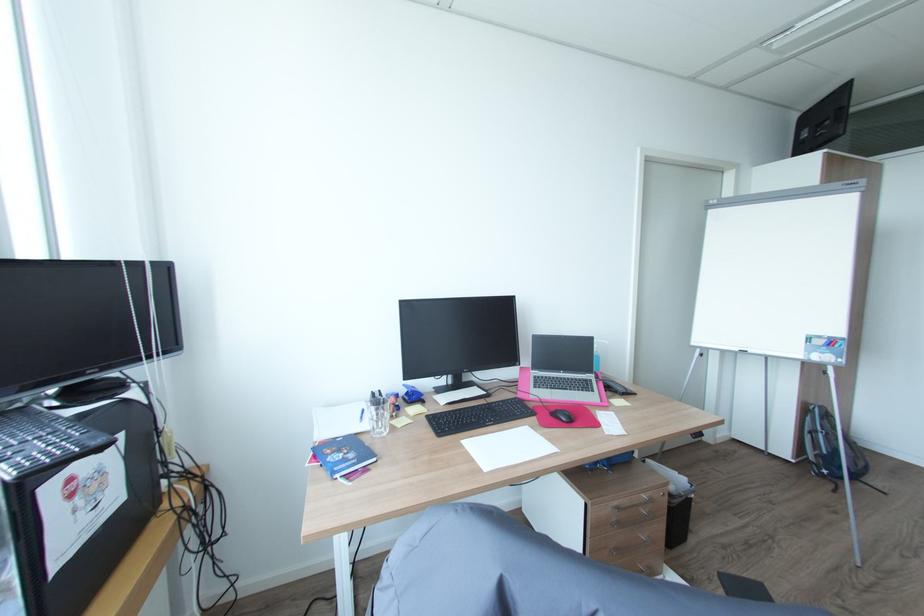
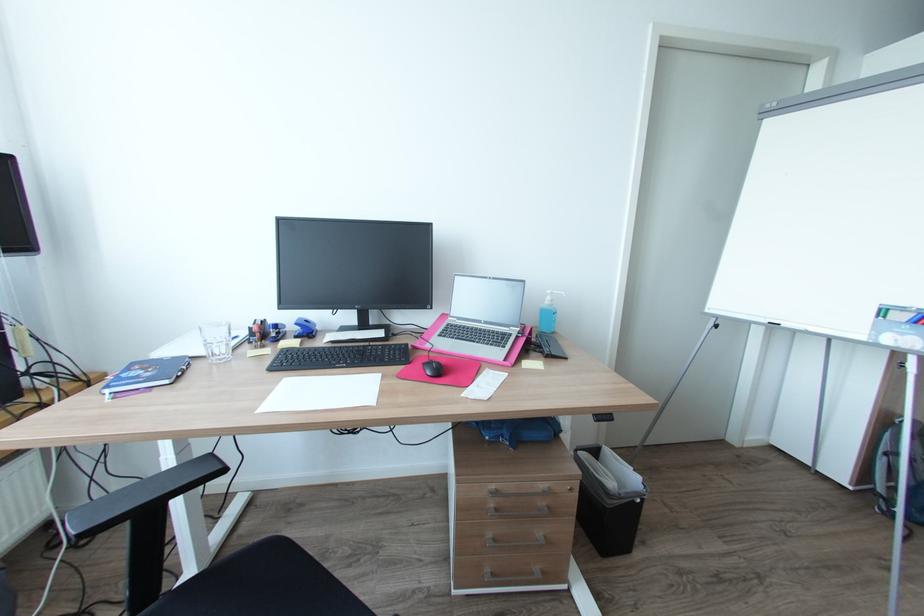
Where in the second image is the point corresponding to point 570,416 from the first image?

(438, 368)